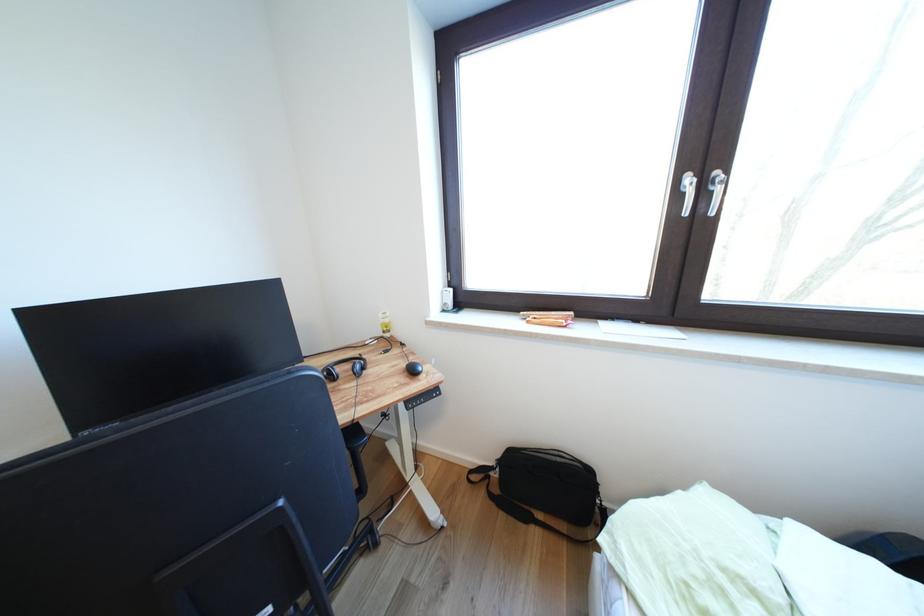
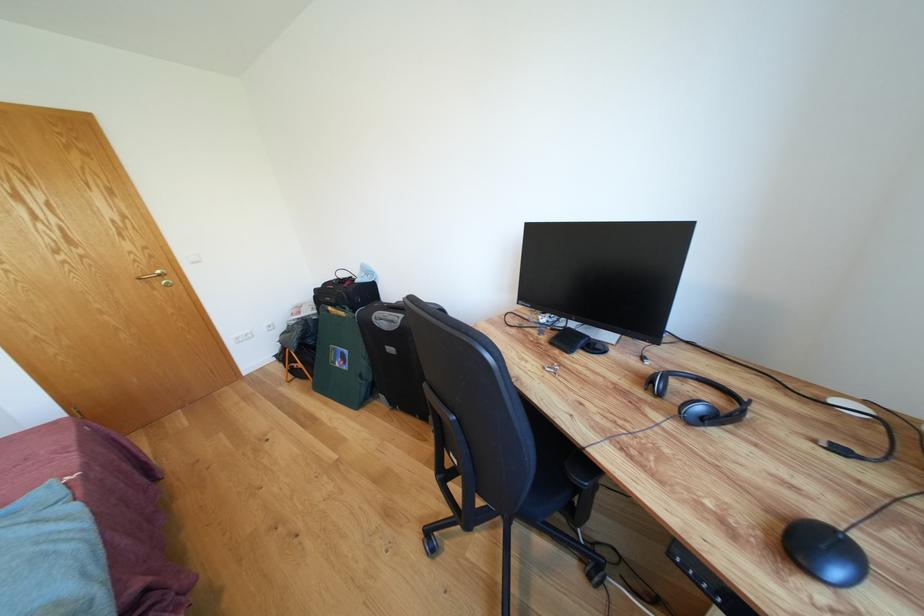
The point at (429, 373) is marked in the first image. Where is the corresponding point in the second image?

(844, 578)